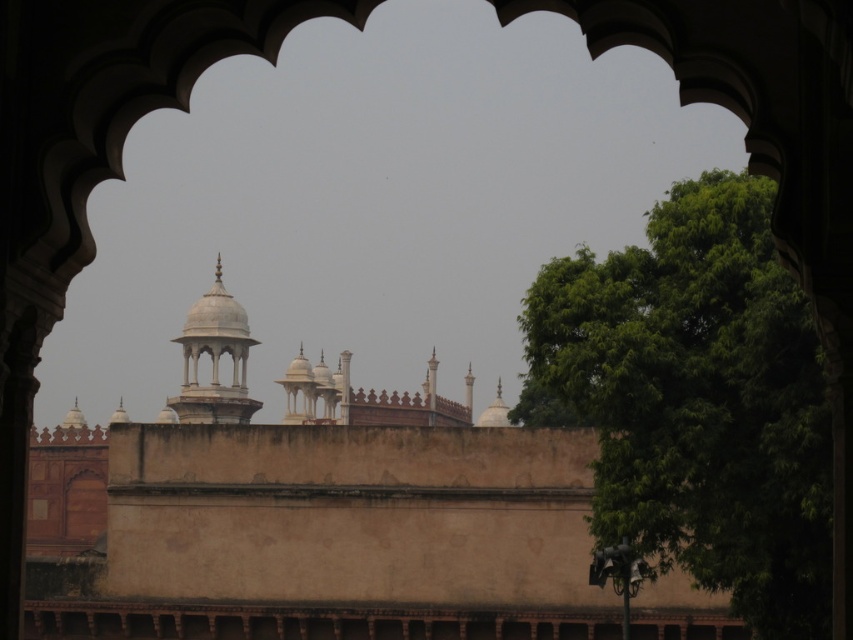
Looking at this image, you are standing in front of an ornate archway leading to a distant building complex. You notice two points marked in the scene. The first point is at coordinates point (807, 580), and the second is at point (247, 353). From your perspective, which point is nearer to you?

Point (807, 580) is closer to the viewer than point (247, 353).

You are an architect examining the image. You need to determine if the green leafy tree at right is blocking the view of the white marble tower at center from your current position. Based on the scene, what can you conclude?

The green leafy tree at right is in front of the white marble tower at center, so it is blocking the view of the white marble tower at center from your current position.